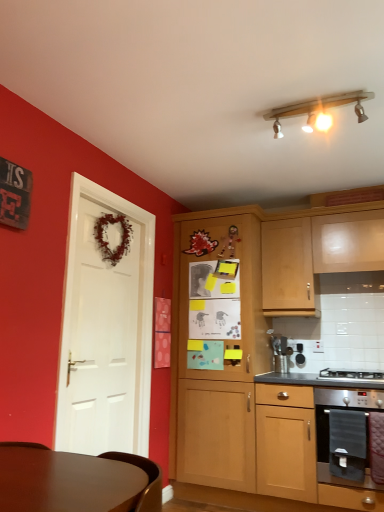
Question: In terms of width, does wooden cabinet at center, the third cabinetry positioned from the right, look wider or thinner when compared to stainless steel oven at lower right?

Choices:
 (A) wide
 (B) thin

Answer: (A)

Question: In terms of size, does wooden cabinet at center, the third cabinetry positioned from the right, appear bigger or smaller than stainless steel oven at lower right?

Choices:
 (A) small
 (B) big

Answer: (B)

Question: Which object is positioned farthest from the white matte door at left?

Choices:
 (A) light wood cabinet at upper right, arranged as the third cabinetry when viewed from the left
 (B) stainless steel oven at lower right
 (C) stainless steel gas stove at lower right
 (D) wooden cabinet at center, the third cabinetry positioned from the right
 (E) stainless steel oven at lower right, arranged as the second cabinetry when viewed from the right

Answer: (C)

Question: Which object is the farthest from the stainless steel oven at lower right, which is the second cabinetry in left-to-right order?

Choices:
 (A) stainless steel oven at lower right
 (B) white matte door at left
 (C) wooden cabinet at center, the 1th cabinetry viewed from the left
 (D) stainless steel gas stove at lower right
 (E) light wood cabinet at upper right, arranged as the third cabinetry when viewed from the left

Answer: (B)